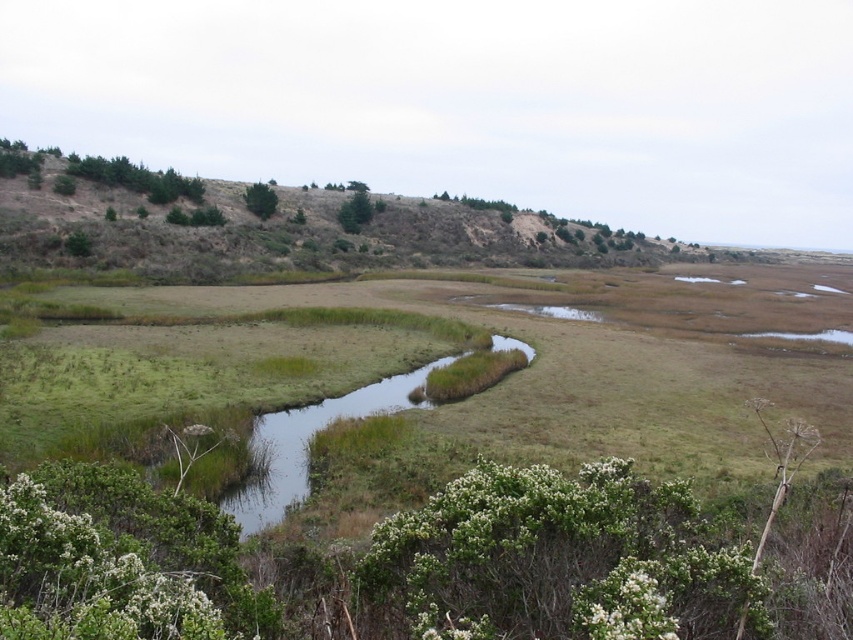
Question: Is brown textured hillside at upper left to the right of green leafy shrub at upper center from the viewer's perspective?

Choices:
 (A) no
 (B) yes

Answer: (B)

Question: In this image, where is brown textured hillside at upper left located relative to green leafy shrub at upper center?

Choices:
 (A) right
 (B) left

Answer: (A)

Question: Which point is farther to the camera?

Choices:
 (A) green leafy shrub at upper center
 (B) brown textured hillside at upper left

Answer: (A)

Question: Which point appears farthest from the camera in this image?

Choices:
 (A) (271, 204)
 (B) (408, 205)

Answer: (B)

Question: From the image, what is the correct spatial relationship of brown textured hillside at upper left in relation to green leafy shrub at upper center?

Choices:
 (A) above
 (B) below

Answer: (A)

Question: Which of the following is the closest to the observer?

Choices:
 (A) (270, 195)
 (B) (341, 195)

Answer: (A)